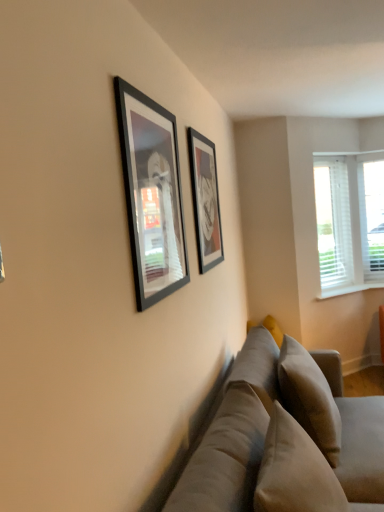
Question: Is matte black picture frame at upper center, which ranks as the 2th picture frame in back-to-front order, facing away from soft beige fabric couch at lower right?

Choices:
 (A) no
 (B) yes

Answer: (A)

Question: Is soft beige fabric couch at lower right completely or partially inside matte black picture frame at upper center, which appears as the first picture frame when viewed from the front?

Choices:
 (A) no
 (B) yes

Answer: (A)

Question: Is matte black picture frame at upper center, the 2th picture frame from the right, positioned before soft beige fabric couch at lower right?

Choices:
 (A) no
 (B) yes

Answer: (A)

Question: Can we say matte black picture frame at upper center, which appears as the first picture frame when viewed from the front, lies outside soft beige fabric couch at lower right?

Choices:
 (A) yes
 (B) no

Answer: (A)

Question: From the image's perspective, is matte black picture frame at upper center, which ranks as the 2th picture frame in back-to-front order, located beneath soft beige fabric couch at lower right?

Choices:
 (A) yes
 (B) no

Answer: (B)

Question: Considering the relative sizes of matte black picture frame at upper center, which appears as the first picture frame when viewed from the front, and soft beige fabric couch at lower right in the image provided, is matte black picture frame at upper center, which appears as the first picture frame when viewed from the front, bigger than soft beige fabric couch at lower right?

Choices:
 (A) yes
 (B) no

Answer: (B)

Question: Is soft beige fabric couch at lower right facing towards matte black picture frame at center, arranged as the 1th picture frame when viewed from the right?

Choices:
 (A) no
 (B) yes

Answer: (A)

Question: From the image's perspective, is soft beige fabric couch at lower right under matte black picture frame at center, arranged as the 1th picture frame when viewed from the right?

Choices:
 (A) no
 (B) yes

Answer: (B)

Question: From a real-world perspective, is soft beige fabric couch at lower right over matte black picture frame at center, the 2th picture frame positioned from the front?

Choices:
 (A) yes
 (B) no

Answer: (B)

Question: Is soft beige fabric couch at lower right bigger than matte black picture frame at center, which is the 2th picture frame in left-to-right order?

Choices:
 (A) no
 (B) yes

Answer: (B)

Question: Is the depth of soft beige fabric couch at lower right greater than that of matte black picture frame at center, which is counted as the first picture frame, starting from the back?

Choices:
 (A) yes
 (B) no

Answer: (B)

Question: From a real-world perspective, does soft beige fabric couch at lower right sit lower than matte black picture frame at center, which is the 2th picture frame in left-to-right order?

Choices:
 (A) yes
 (B) no

Answer: (A)

Question: Does white plastic blinds at right have a lesser height compared to soft beige pillow at lower right?

Choices:
 (A) no
 (B) yes

Answer: (A)